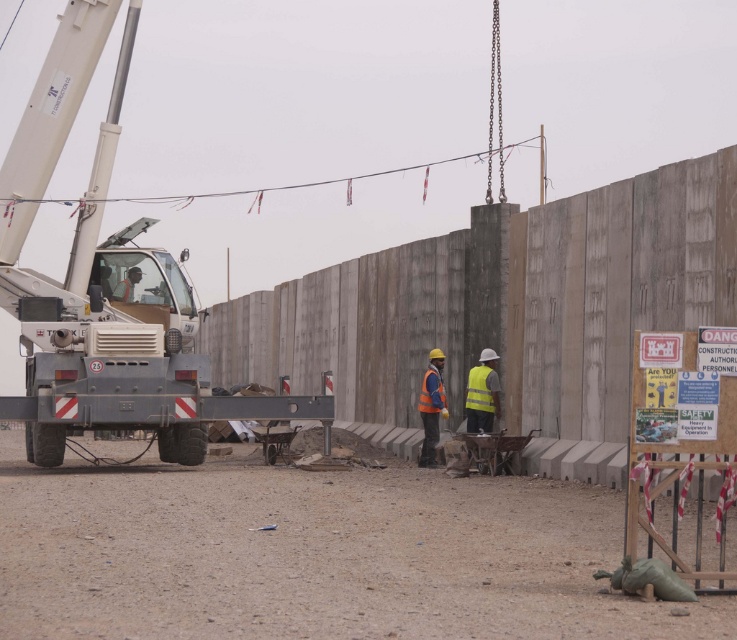
I want to click on gray metallic crane at left, so click(x=104, y=284).

Does gray metallic crane at left appear under orange reflective safety vest at center?

No, gray metallic crane at left is not below orange reflective safety vest at center.

The image size is (737, 640). I want to click on gray metallic crane at left, so click(104, 284).

Where is `gray metallic crane at left`? The height and width of the screenshot is (640, 737). gray metallic crane at left is located at coordinates (104, 284).

Can you confirm if gray metallic crane at left is bigger than yellow reflective safety vest at center?

Yes, gray metallic crane at left is bigger than yellow reflective safety vest at center.

Which is behind, point (29, 285) or point (475, 384)?

The point (475, 384) is behind.

The width and height of the screenshot is (737, 640). Describe the element at coordinates (104, 284) in the screenshot. I see `gray metallic crane at left` at that location.

You are a GUI agent. You are given a task and a screenshot of the screen. Output one action in this format:
    pyautogui.click(x=<x>, y=<y>)
    Task: Click on the gray metallic crane at left
    The image size is (737, 640).
    Given the screenshot: What is the action you would take?
    pyautogui.click(x=104, y=284)

Between reflective orange vest at center and yellow reflective safety vest at center, which one has less height?

With less height is yellow reflective safety vest at center.

Measure the distance between reflective orange vest at center and camera.

reflective orange vest at center and camera are 22.15 meters apart from each other.

This screenshot has height=640, width=737. I want to click on reflective orange vest at center, so click(x=430, y=406).